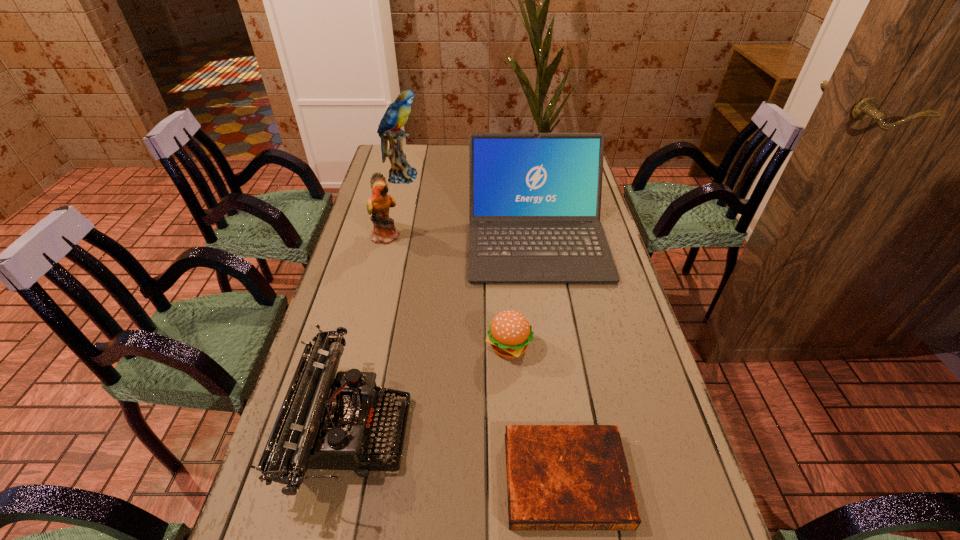
Identify the location of free spot located 0.380m on the keyboard of the third shortest object. (581, 429).

Where is `vacant space located 0.400m on the left of the hamburger`? The width and height of the screenshot is (960, 540). vacant space located 0.400m on the left of the hamburger is located at coordinates (330, 347).

This screenshot has height=540, width=960. Identify the location of object that is at the far edge. (396, 115).

The image size is (960, 540). I want to click on typewriter that is positioned at the left edge, so click(325, 422).

The height and width of the screenshot is (540, 960). What are the coordinates of `laptop computer that is at the right edge` in the screenshot? It's located at (534, 198).

Where is `Bible that is positioned at the right edge`? This screenshot has width=960, height=540. Bible that is positioned at the right edge is located at coordinates (559, 477).

At what (x,y) coordinates should I click in order to perform the action: click on object that is positioned at the far left corner. Please return your answer as a coordinate pair (x, y). This screenshot has height=540, width=960. Looking at the image, I should click on (396, 115).

At what (x,y) coordinates should I click in order to perform the action: click on free space at the left edge of the desktop. Please return your answer as a coordinate pair (x, y). Looking at the image, I should click on (336, 538).

Locate an element on the screen. free space at the right edge is located at coordinates (592, 298).

Find the location of a particular element. This screenshot has width=960, height=540. free space between the laptop computer and the nearer parrot is located at coordinates (462, 237).